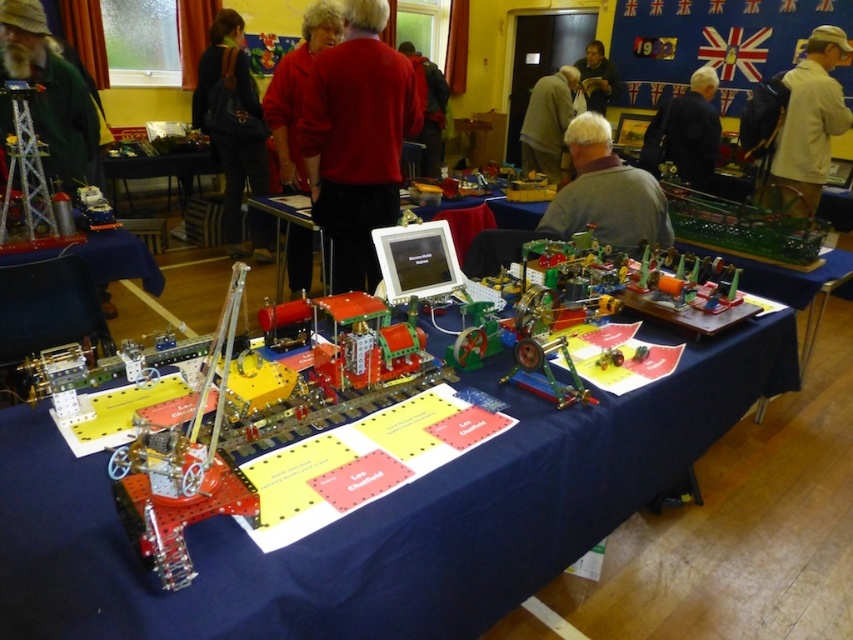
You are a photographer at the event and want to capture both the red matte shirt at center and the light brown leather jacket at upper center in a single frame. Which object should you focus on first to ensure both are in the shot?

You should focus on the light brown leather jacket at upper center first because the red matte shirt at center is located below it, so adjusting the camera angle to include the upper object will naturally include the lower one as well.

You are at the hobby show and see two jackets displayed on a table. The tan fabric jacket at upper right and the red matte jacket at center. Which jacket is positioned more to the east side of the table?

→ The tan fabric jacket at upper right is positioned more to the east side of the table since it is to the right of the red matte jacket at center, implying an eastern orientation based on standard map reading where right corresponds to east.

You are a photographer at the event and want to capture both the red matte shirt at center and the tan fabric jacket at upper right in a single frame. Since the camera has a limited field of view, which object should you position closer to the camera to ensure both are in focus?

The red matte shirt at center has a lesser width compared to tan fabric jacket at upper right, so you should position the red matte shirt at center closer to the camera to ensure both are in focus.